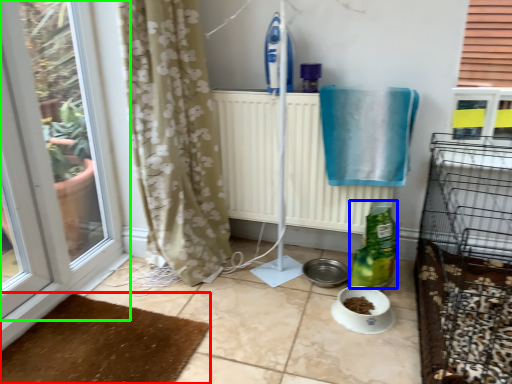
Question: Considering the real-world distances, which object is farthest from doormat (highlighted by a red box)? bottle (highlighted by a blue box) or window (highlighted by a green box)?

Choices:
 (A) bottle
 (B) window

Answer: (A)